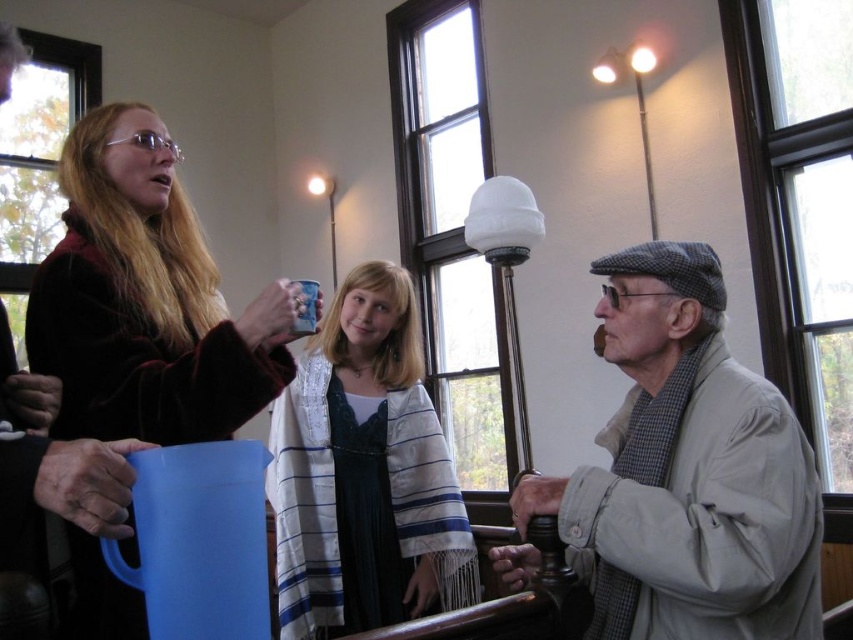
Which is below, white striped shawl at center or blue plastic mug at upper left?

white striped shawl at center

Is point (399, 435) less distant than point (198, 595)?

No, (399, 435) is behind (198, 595).

The image size is (853, 640). What are the coordinates of `white striped shawl at center` in the screenshot? It's located at (364, 474).

Does velvet maroon coat at upper left lie in front of blue matte mug at center?

Yes, it is in front of blue matte mug at center.

Identify the location of velvet maroon coat at upper left. This screenshot has width=853, height=640. (146, 300).

In the scene shown: Measure the distance between velvet maroon coat at upper left and camera.

velvet maroon coat at upper left and camera are 1.21 meters apart.

What are the coordinates of `velvet maroon coat at upper left` in the screenshot? It's located at (146, 300).

Is the position of white striped shawl at center less distant than that of blue matte mug at center?

No, it is behind blue matte mug at center.

Does point (299, 467) come farther from viewer compared to point (306, 328)?

Yes, point (299, 467) is farther from viewer.

Between point (434, 428) and point (316, 301), which one is positioned behind?

Point (434, 428)

Identify the location of white striped shawl at center. (364, 474).